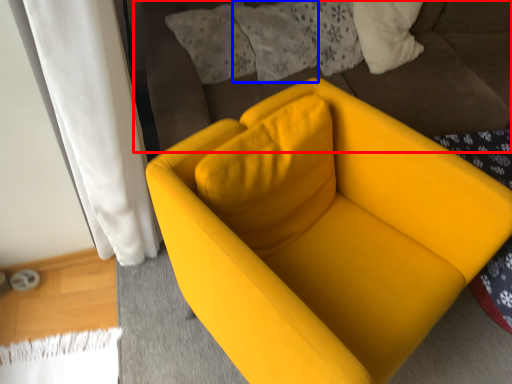
Question: Among these objects, which one is farthest to the camera, bedding (highlighted by a red box) or pillow (highlighted by a blue box)?

Choices:
 (A) bedding
 (B) pillow

Answer: (B)